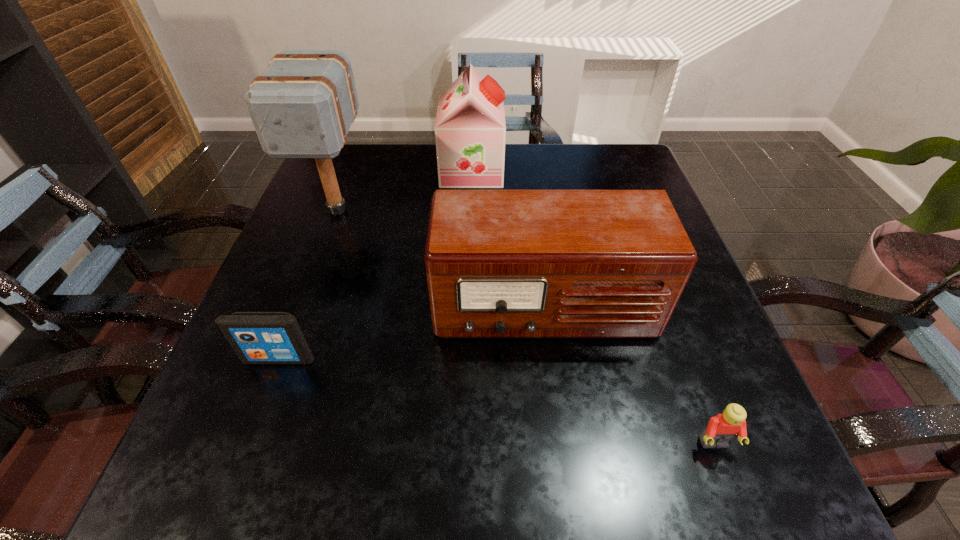
Identify the location of the tallest object. (302, 106).

This screenshot has height=540, width=960. In order to click on soya milk in this screenshot , I will do [x=470, y=130].

In order to click on the third farthest object in this screenshot , I will do `click(499, 263)`.

The width and height of the screenshot is (960, 540). What are the coordinates of `the third tallest object` in the screenshot? It's located at (499, 263).

Locate an element on the screen. the second nearest object is located at coordinates (257, 337).

Locate an element on the screen. This screenshot has width=960, height=540. Lego is located at coordinates (722, 428).

You are a GUI agent. You are given a task and a screenshot of the screen. Output one action in this format:
    pyautogui.click(x=<x>, y=<y>)
    Task: Click on the shortest object
    
    Given the screenshot: What is the action you would take?
    pyautogui.click(x=722, y=428)

This screenshot has width=960, height=540. Identify the location of free space located on the striking surface of the mallet. (271, 393).

At what (x,y) coordinates should I click in order to perform the action: click on vacant space located with the cap open on the soya milk. Please return your answer as a coordinate pair (x, y). Image resolution: width=960 pixels, height=540 pixels. Looking at the image, I should click on (625, 170).

Image resolution: width=960 pixels, height=540 pixels. Find the location of `vacant space located 0.200m on the front-facing side of the radio receiver`. vacant space located 0.200m on the front-facing side of the radio receiver is located at coordinates (564, 463).